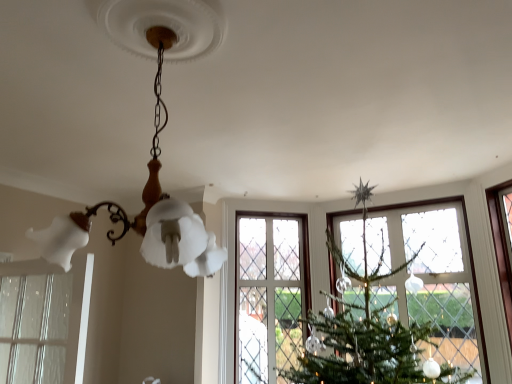
Measure the distance between matte white glass chandelier at upper center and camera.

They are 90.20 centimeters apart.

The width and height of the screenshot is (512, 384). What are the coordinates of `matte white glass chandelier at upper center` in the screenshot? It's located at (152, 141).

Describe the element at coordinates (152, 141) in the screenshot. I see `matte white glass chandelier at upper center` at that location.

This screenshot has height=384, width=512. What are the coordinates of `clear glass window at lower left` in the screenshot? It's located at (44, 320).

Measure the distance between clear glass window at lower left and camera.

The distance of clear glass window at lower left from camera is 6.45 feet.

The width and height of the screenshot is (512, 384). What do you see at coordinates (44, 320) in the screenshot?
I see `clear glass window at lower left` at bounding box center [44, 320].

The height and width of the screenshot is (384, 512). I want to click on matte white glass chandelier at upper center, so click(x=152, y=141).

Is matte white glass chandelier at upper center to the left of clear glass window at lower left from the viewer's perspective?

No, matte white glass chandelier at upper center is not to the left of clear glass window at lower left.

Does matte white glass chandelier at upper center come in front of clear glass window at lower left?

Yes, matte white glass chandelier at upper center is closer to the viewer.

Is point (31, 230) closer or farther from the camera than point (12, 306)?

Point (31, 230) is farther from the camera than point (12, 306).

From the image's perspective, which is below, matte white glass chandelier at upper center or clear glass window at lower left?

clear glass window at lower left appears lower in the image.

From a real-world perspective, is matte white glass chandelier at upper center positioned above or below clear glass window at lower left?

In terms of real-world spatial position, matte white glass chandelier at upper center is above clear glass window at lower left.

Does matte white glass chandelier at upper center have a lesser width compared to clear glass window at lower left?

No, matte white glass chandelier at upper center is not thinner than clear glass window at lower left.

Considering the relative sizes of matte white glass chandelier at upper center and clear glass window at lower left in the image provided, is matte white glass chandelier at upper center shorter than clear glass window at lower left?

In fact, matte white glass chandelier at upper center may be taller than clear glass window at lower left.

Is matte white glass chandelier at upper center bigger than clear glass window at lower left?

Yes.

Looking at this image, is matte white glass chandelier at upper center surrounding clear glass window at lower left?

No, clear glass window at lower left is not inside matte white glass chandelier at upper center.

Is matte white glass chandelier at upper center far from clear glass window at lower left?

Yes.

Is matte white glass chandelier at upper center facing away from clear glass window at lower left?

matte white glass chandelier at upper center is not turned away from clear glass window at lower left.

Measure the distance between matte white glass chandelier at upper center and clear glass window at lower left.

They are 3.60 feet apart.

Where is `window below the matte white glass chandelier at upper center (from a real-world perspective)`? Image resolution: width=512 pixels, height=384 pixels. window below the matte white glass chandelier at upper center (from a real-world perspective) is located at coordinates (44, 320).

Between clear glass window at lower left and matte white glass chandelier at upper center, which one appears on the right side from the viewer's perspective?

matte white glass chandelier at upper center.

Who is more distant, clear glass window at lower left or matte white glass chandelier at upper center?

clear glass window at lower left is further from the camera.

Does point (10, 346) appear closer or farther from the camera than point (164, 120)?

Point (10, 346) is farther from the camera than point (164, 120).

From the image's perspective, is clear glass window at lower left located above or below matte white glass chandelier at upper center?

From the image's perspective, clear glass window at lower left appears below matte white glass chandelier at upper center.

From a real-world perspective, is clear glass window at lower left above or below matte white glass chandelier at upper center?

clear glass window at lower left is situated lower than matte white glass chandelier at upper center in the real world.

Considering the relative sizes of clear glass window at lower left and matte white glass chandelier at upper center in the image provided, is clear glass window at lower left wider than matte white glass chandelier at upper center?

In fact, clear glass window at lower left might be narrower than matte white glass chandelier at upper center.

In terms of height, does clear glass window at lower left look taller or shorter compared to matte white glass chandelier at upper center?

Clearly, clear glass window at lower left is shorter compared to matte white glass chandelier at upper center.

Can you confirm if clear glass window at lower left is smaller than matte white glass chandelier at upper center?

Indeed, clear glass window at lower left has a smaller size compared to matte white glass chandelier at upper center.

Is clear glass window at lower left inside the boundaries of matte white glass chandelier at upper center, or outside?

clear glass window at lower left is located beyond the bounds of matte white glass chandelier at upper center.

Would you consider clear glass window at lower left to be distant from matte white glass chandelier at upper center?

Absolutely, clear glass window at lower left is distant from matte white glass chandelier at upper center.

Is clear glass window at lower left aimed at matte white glass chandelier at upper center?

No, clear glass window at lower left is not turned towards matte white glass chandelier at upper center.

This screenshot has width=512, height=384. I want to click on window below the matte white glass chandelier at upper center (from the image's perspective), so click(x=44, y=320).

Where is `window behind the matte white glass chandelier at upper center`? The height and width of the screenshot is (384, 512). window behind the matte white glass chandelier at upper center is located at coordinates (44, 320).

Identify the location of lamp that is in front of the clear glass window at lower left. This screenshot has width=512, height=384. (152, 141).